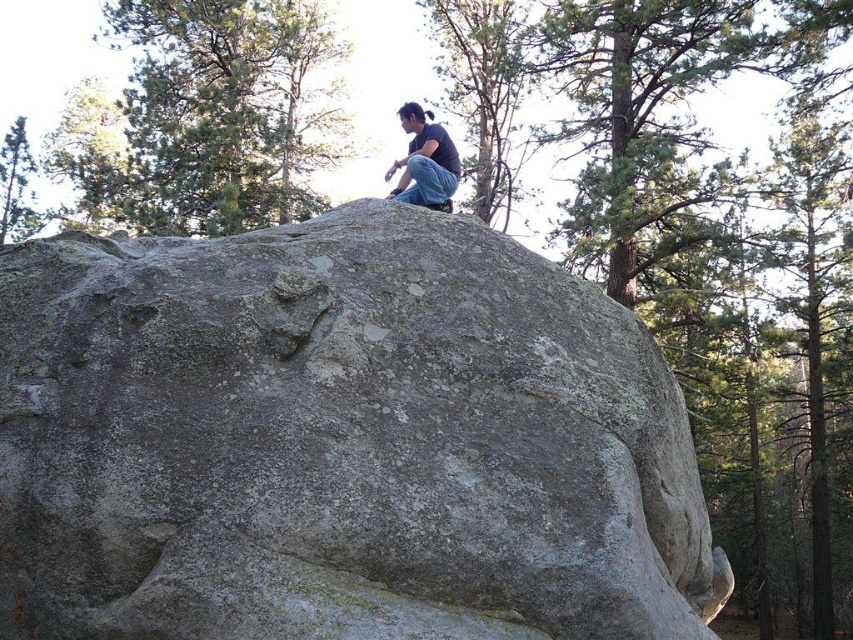
You are planning to place a small garden statue that requires a base larger than the gray rough rock at center. Is the green textured tree at upper left a suitable base for it?

The gray rough rock at center is bigger than the green textured tree at upper left. Since the statue requires a base larger than the gray rough rock at center, the green textured tree at upper left is not big enough to serve as a suitable base.